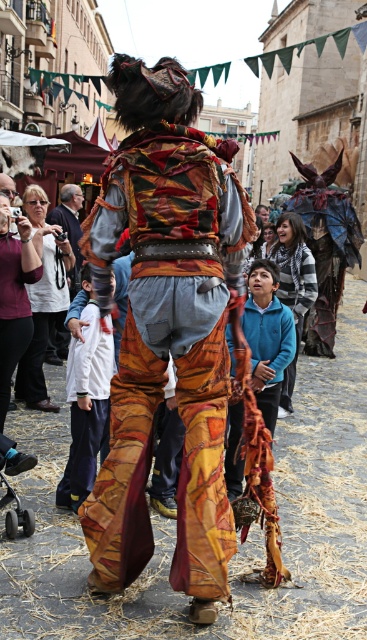
Question: Estimate the real-world distances between objects in this image. Which object is farther from the matte black camera at left?

Choices:
 (A) textured fabric costume at center
 (B) blue fleece sweater at center

Answer: (A)

Question: Which object is closer to the camera taking this photo?

Choices:
 (A) textured fabric costume at center
 (B) matte black camera at left
 (C) blue fleece sweater at center

Answer: (A)

Question: Can you confirm if textured fabric costume at center is positioned below matte black camera at left?

Choices:
 (A) yes
 (B) no

Answer: (A)

Question: Considering the relative positions of blue fleece sweater at center and matte black camera at left in the image provided, where is blue fleece sweater at center located with respect to matte black camera at left?

Choices:
 (A) below
 (B) above

Answer: (A)

Question: Estimate the real-world distances between objects in this image. Which object is farther from the matte black camera at left?

Choices:
 (A) textured fabric costume at center
 (B) blue fleece sweater at center

Answer: (A)

Question: Where is textured fabric costume at center located in relation to matte black camera at left in the image?

Choices:
 (A) left
 (B) right

Answer: (B)